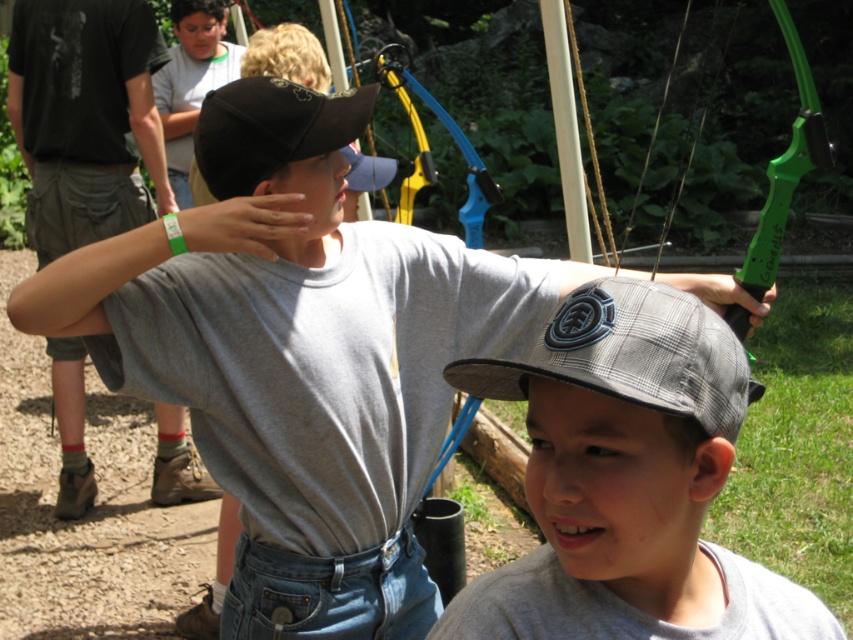
Does point (577, 596) come closer to viewer compared to point (341, 96)?

Yes, it is.

Can you confirm if gray checkered cap at center is shorter than black matte baseball cap at upper center?

No.

This screenshot has width=853, height=640. Identify the location of gray checkered cap at center. (625, 362).

The image size is (853, 640). I want to click on gray checkered cap at center, so click(625, 362).

Is the position of plaid fabric baseball cap at center less distant than that of black matte baseball cap at upper center?

That is True.

From the picture: Can you confirm if plaid fabric baseball cap at center is positioned above black matte baseball cap at upper center?

No.

Which is in front, point (711, 388) or point (227, 120)?

Point (711, 388) is in front.

Locate an element on the screen. This screenshot has width=853, height=640. plaid fabric baseball cap at center is located at coordinates (631, 356).

Does gray checkered cap at center have a greater width compared to plaid fabric baseball cap at center?

Correct, the width of gray checkered cap at center exceeds that of plaid fabric baseball cap at center.

Can you confirm if gray checkered cap at center is positioned to the right of plaid fabric baseball cap at center?

Indeed, gray checkered cap at center is positioned on the right side of plaid fabric baseball cap at center.

Locate an element on the screen. The height and width of the screenshot is (640, 853). gray checkered cap at center is located at coordinates (625, 362).